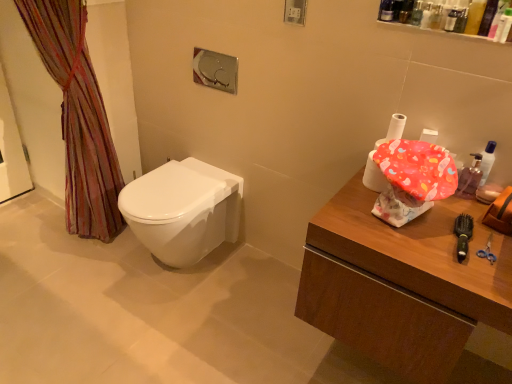
Question: Based on their positions, is multicolored fabric curtain at left located to the left or right of translucent plastic mouthwash at upper right, which appears as the second mouthwash when viewed from the front?

Choices:
 (A) right
 (B) left

Answer: (B)

Question: From a real-world perspective, is multicolored fabric curtain at left positioned above or below translucent plastic mouthwash at upper right, the 1th mouthwash when ordered from back to front?

Choices:
 (A) above
 (B) below

Answer: (B)

Question: Estimate the real-world distances between objects in this image. Which object is farther from the translucent plastic container at upper right, which ranks as the 2th toiletry in left-to-right order?

Choices:
 (A) green plastic brush at right
 (B) translucent plastic bottles at upper right, which is the second toiletry from right to left
 (C) white plastic bottle at upper right, positioned as the first mouthwash in front-to-back order
 (D) white glossy toilet at center
 (E) translucent plastic mouthwash at upper right, marked as the second mouthwash in a top-to-bottom arrangement

Answer: (D)

Question: Which object is positioned farthest from the translucent plastic mouthwash at upper right, marked as the second mouthwash in a top-to-bottom arrangement?

Choices:
 (A) green plastic brush at right
 (B) matte pink fabric toilet paper at right
 (C) wooden counter at right
 (D) translucent plastic bottles at upper right, which appears as the first toiletry when viewed from the left
 (E) translucent plastic container at upper right, which is the 1th toiletry from right to left

Answer: (D)